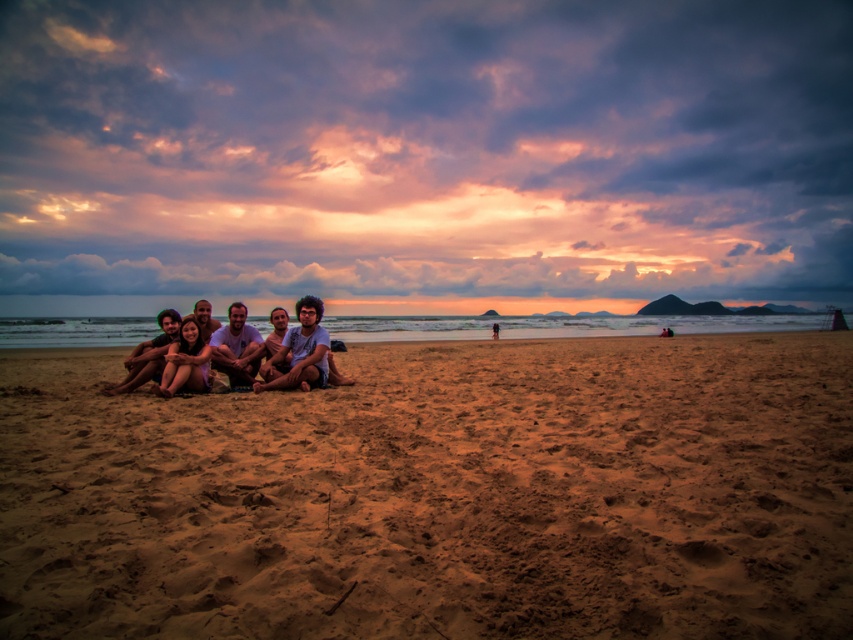
Who is shorter, matte white shirt at center or matte skin people at center?

matte skin people at center

Which is behind, point (187, 342) or point (137, 365)?

The point (187, 342) is behind.

At what (x,y) coordinates should I click in order to perform the action: click on matte white shirt at center. Please return your answer as a coordinate pair (x, y). This screenshot has width=853, height=640. Looking at the image, I should click on (200, 353).

Is brown sandy beach at center positioned in front of curly-haired person at center?

Yes, it is in front of curly-haired person at center.

Which is in front, point (83, 595) or point (285, 348)?

Point (83, 595) is more forward.

Where is `brown sandy beach at center`? The image size is (853, 640). brown sandy beach at center is located at coordinates (439, 493).

Where is `matte white shirt at center`? The height and width of the screenshot is (640, 853). matte white shirt at center is located at coordinates (200, 353).